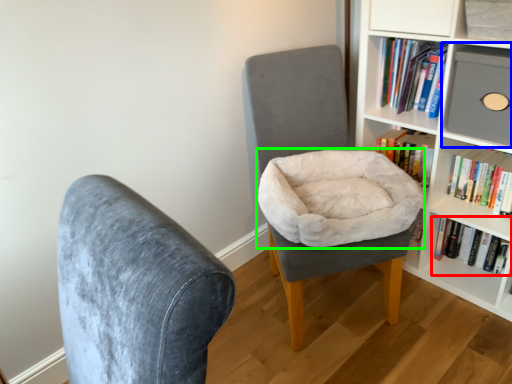
Question: Based on their relative distances, which object is nearer to book (highlighted by a red box)? Choose from shelf (highlighted by a blue box) and bean bag chair (highlighted by a green box).

Choices:
 (A) shelf
 (B) bean bag chair

Answer: (A)